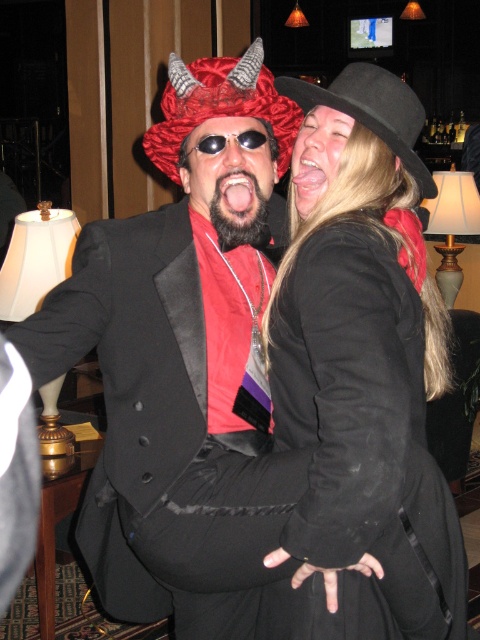
Question: Among these points, which one is nearest to the camera?

Choices:
 (A) (279, 164)
 (B) (317, 323)
 (C) (345, 76)

Answer: (B)

Question: Is shiny red fabric hat at upper center smaller than black felt hat at upper right?

Choices:
 (A) no
 (B) yes

Answer: (A)

Question: Is the position of shiny red fabric hat at upper center less distant than that of sunglassesmetallicgoggles at center?

Choices:
 (A) yes
 (B) no

Answer: (A)

Question: Which of the following is the closest to the observer?

Choices:
 (A) (311, 394)
 (B) (274, 147)

Answer: (A)

Question: Can you confirm if black felt hat at upper right is thinner than sunglassesmetallicgoggles at center?

Choices:
 (A) no
 (B) yes

Answer: (A)

Question: Which is farther from the sunglassesmetallicgoggles at center?

Choices:
 (A) shiny red fabric hat at upper center
 (B) black felt hat at upper right
 (C) black matte coat at center

Answer: (C)